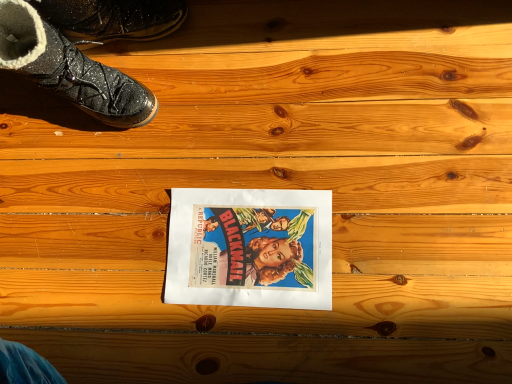
Locate an element on the screen. This screenshot has height=384, width=512. empty space that is to the right of shiny black boot at upper left, which is the 2th footwear from top to bottom is located at coordinates (192, 74).